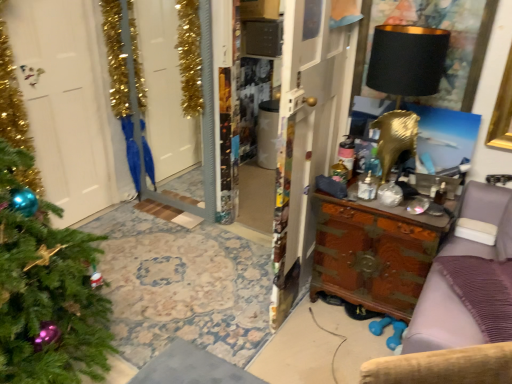
Question: Considering the relative sizes of gold metallic screen door at upper left and black fabric picture frame at upper right in the image provided, is gold metallic screen door at upper left thinner than black fabric picture frame at upper right?

Choices:
 (A) yes
 (B) no

Answer: (B)

Question: Is gold metallic screen door at upper left outside black fabric picture frame at upper right?

Choices:
 (A) yes
 (B) no

Answer: (A)

Question: From a real-world perspective, does gold metallic screen door at upper left stand above black fabric picture frame at upper right?

Choices:
 (A) no
 (B) yes

Answer: (A)

Question: Considering the relative positions of gold metallic screen door at upper left and black fabric picture frame at upper right in the image provided, is gold metallic screen door at upper left to the right of black fabric picture frame at upper right from the viewer's perspective?

Choices:
 (A) yes
 (B) no

Answer: (B)

Question: Is gold metallic screen door at upper left shorter than black fabric picture frame at upper right?

Choices:
 (A) no
 (B) yes

Answer: (A)

Question: Considering their positions, is black matte lampshade at upper right located in front of or behind wooden chest at center?

Choices:
 (A) behind
 (B) front

Answer: (A)

Question: Based on their sizes in the image, would you say black matte lampshade at upper right is bigger or smaller than wooden chest at center?

Choices:
 (A) big
 (B) small

Answer: (B)

Question: From a real-world perspective, relative to wooden chest at center, is black matte lampshade at upper right vertically above or below?

Choices:
 (A) below
 (B) above

Answer: (B)

Question: Considering the relative positions of black matte lampshade at upper right and wooden chest at center in the image provided, is black matte lampshade at upper right to the left or to the right of wooden chest at center?

Choices:
 (A) left
 (B) right

Answer: (B)

Question: Is black matte lampshade at upper right inside or outside of black fabric picture frame at upper right?

Choices:
 (A) inside
 (B) outside

Answer: (B)

Question: From the image's perspective, is black matte lampshade at upper right located above or below black fabric picture frame at upper right?

Choices:
 (A) below
 (B) above

Answer: (A)

Question: Relative to black fabric picture frame at upper right, is black matte lampshade at upper right in front or behind?

Choices:
 (A) front
 (B) behind

Answer: (A)

Question: From their relative heights in the image, would you say black matte lampshade at upper right is taller or shorter than black fabric picture frame at upper right?

Choices:
 (A) tall
 (B) short

Answer: (A)

Question: Would you say wooden chest at right is inside or outside gold metallic screen door at upper left?

Choices:
 (A) outside
 (B) inside

Answer: (A)

Question: In the image, is wooden chest at right on the left side or the right side of gold metallic screen door at upper left?

Choices:
 (A) left
 (B) right

Answer: (B)